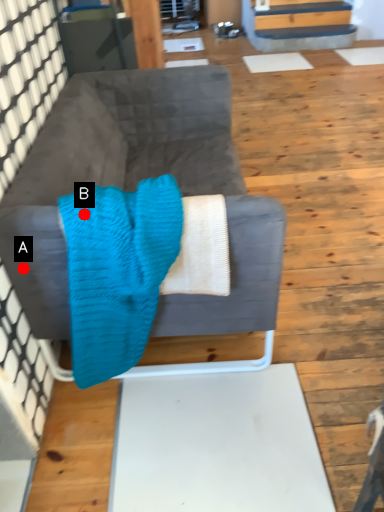
Question: Two points are circled on the image, labeled by A and B beside each circle. Which point appears farthest from the camera in this image?

Choices:
 (A) A is further
 (B) B is further

Answer: (A)